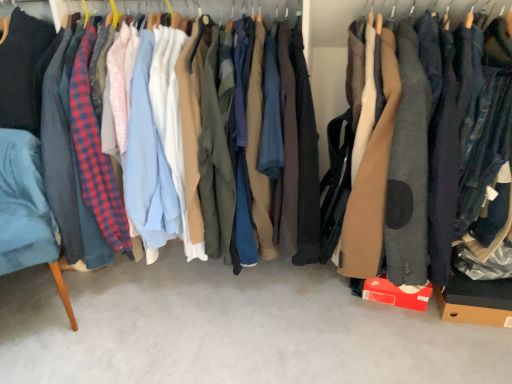
What do you see at coordinates (241, 8) in the screenshot?
I see `matte black jacket at center` at bounding box center [241, 8].

The height and width of the screenshot is (384, 512). I want to click on velvet blue armchair at left, so click(x=27, y=212).

What do you see at coordinates (27, 212) in the screenshot?
I see `velvet blue armchair at left` at bounding box center [27, 212].

Identify the location of matte brown coat at center. The width and height of the screenshot is (512, 384). (390, 170).

Which is behind, matte black jacket at center or matte brown coat at center?

matte black jacket at center is further away from the camera.

Considering the sizes of objects matte black jacket at center and matte brown coat at center in the image provided, who is smaller, matte black jacket at center or matte brown coat at center?

With smaller size is matte brown coat at center.

Could you tell me if matte black jacket at center is facing matte brown coat at center?

No, matte black jacket at center is not facing towards matte brown coat at center.

Image resolution: width=512 pixels, height=384 pixels. I want to click on closet on the left of matte brown coat at center, so click(241, 8).

Is brown cardboard box at lower right thinner than matte black jacket at center?

Yes, brown cardboard box at lower right is thinner than matte black jacket at center.

From the image's perspective, is brown cardboard box at lower right positioned above or below matte black jacket at center?

Clearly, from the image's perspective, brown cardboard box at lower right is below matte black jacket at center.

Based on the photo, is brown cardboard box at lower right aimed at matte black jacket at center?

No, brown cardboard box at lower right is not oriented towards matte black jacket at center.

Which is in front, brown cardboard box at lower right or matte black jacket at center?

matte black jacket at center.

Which is in front, point (58, 2) or point (496, 310)?

The point (496, 310) is more forward.

Is matte black jacket at center not inside brown cardboard box at lower right?

Yes.

From the image's perspective, is matte black jacket at center on top of brown cardboard box at lower right?

Yes, from the image's perspective, matte black jacket at center is over brown cardboard box at lower right.

Considering the relative sizes of velvet blue armchair at left and matte brown coat at center in the image provided, is velvet blue armchair at left taller than matte brown coat at center?

No.

Relative to matte brown coat at center, is velvet blue armchair at left in front or behind?

velvet blue armchair at left is positioned farther from the viewer than matte brown coat at center.

Can you confirm if velvet blue armchair at left is positioned to the right of matte brown coat at center?

No, velvet blue armchair at left is not to the right of matte brown coat at center.

Considering the points (29, 211) and (360, 127), which point is in front, point (29, 211) or point (360, 127)?

The point (360, 127) is in front.

Is point (380, 141) farther from viewer compared to point (34, 179)?

No, (380, 141) is closer to viewer.

Is matte brown coat at center inside the boundaries of velvet blue armchair at left, or outside?

matte brown coat at center exists outside the volume of velvet blue armchair at left.

Considering the positions of objects matte brown coat at center and velvet blue armchair at left in the image provided, who is behind, matte brown coat at center or velvet blue armchair at left?

velvet blue armchair at left is further from the camera.

Is velvet blue armchair at left oriented towards matte black jacket at center?

No.

Can you confirm if velvet blue armchair at left is smaller than matte black jacket at center?

Correct, velvet blue armchair at left occupies less space than matte black jacket at center.

Considering the sizes of objects velvet blue armchair at left and matte black jacket at center in the image provided, who is wider, velvet blue armchair at left or matte black jacket at center?

With larger width is matte black jacket at center.

Between velvet blue armchair at left and matte black jacket at center, which one appears on the right side from the viewer's perspective?

matte black jacket at center.

Is point (1, 101) closer or farther from the camera than point (24, 220)?

Clearly, point (1, 101) is more distant from the camera than point (24, 220).

From a real-world perspective, relative to velvet blue armchair at left, is matte black jacket at center vertically above or below?

Clearly, from a real-world perspective, matte black jacket at center is above velvet blue armchair at left.

Where is `furniture located behind the matte black jacket at center`? furniture located behind the matte black jacket at center is located at coordinates (27, 212).

Can you confirm if matte black jacket at center is wider than velvet blue armchair at left?

Indeed, matte black jacket at center has a greater width compared to velvet blue armchair at left.

Image resolution: width=512 pixels, height=384 pixels. Find the location of `closet behind the matte brown coat at center`. closet behind the matte brown coat at center is located at coordinates (241, 8).

You are a GUI agent. You are given a task and a screenshot of the screen. Output one action in this format:
    pyautogui.click(x=<x>, y=<y>)
    Task: Click on the closet in front of the brown cardboard box at lower right
    
    Given the screenshot: What is the action you would take?
    pyautogui.click(x=241, y=8)

Which object lies nearer to the anchor point velvet blue armchair at left, matte brown coat at center or matte black jacket at center?

matte black jacket at center is closer to velvet blue armchair at left.

Based on their spatial positions, is velvet blue armchair at left or brown cardboard box at lower right further from matte black jacket at center?

brown cardboard box at lower right lies further to matte black jacket at center than the other object.

From the image, which object appears to be farther from matte black jacket at center, matte brown coat at center or brown cardboard box at lower right?

brown cardboard box at lower right lies further to matte black jacket at center than the other object.

Looking at the image, which one is located closer to brown cardboard box at lower right, matte brown coat at center or velvet blue armchair at left?

Among the two, matte brown coat at center is located nearer to brown cardboard box at lower right.

Estimate the real-world distances between objects in this image. Which object is further from brown cardboard box at lower right, matte brown coat at center or matte black jacket at center?

matte black jacket at center.

When comparing their distances from brown cardboard box at lower right, does velvet blue armchair at left or matte brown coat at center seem closer?

Based on the image, matte brown coat at center appears to be nearer to brown cardboard box at lower right.

Looking at the image, which one is located closer to brown cardboard box at lower right, matte black jacket at center or velvet blue armchair at left?

Among the two, matte black jacket at center is located nearer to brown cardboard box at lower right.

Looking at the image, which one is located closer to velvet blue armchair at left, matte brown coat at center or brown cardboard box at lower right?

Among the two, matte brown coat at center is located nearer to velvet blue armchair at left.

Image resolution: width=512 pixels, height=384 pixels. I want to click on closet between velvet blue armchair at left and matte brown coat at center in the horizontal direction, so click(241, 8).

Find the location of a particular element. clothing situated between velvet blue armchair at left and brown cardboard box at lower right from left to right is located at coordinates (390, 170).

This screenshot has height=384, width=512. What are the coordinates of `closet located between velvet blue armchair at left and brown cardboard box at lower right in the left-right direction` in the screenshot? It's located at (241, 8).

Where is `clothing located between matte black jacket at center and brown cardboard box at lower right in the left-right direction`? Image resolution: width=512 pixels, height=384 pixels. clothing located between matte black jacket at center and brown cardboard box at lower right in the left-right direction is located at coordinates (390, 170).